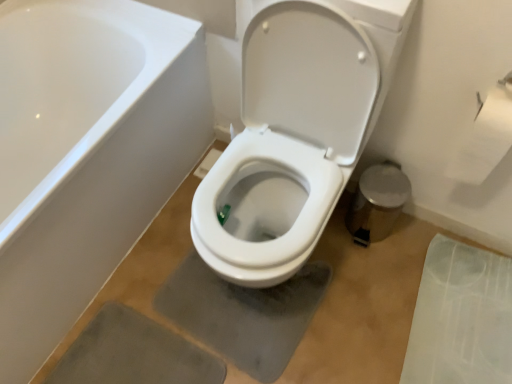
Question: Can you confirm if white glossy toilet at center is positioned to the left of transparent plastic mat at lower right?

Choices:
 (A) yes
 (B) no

Answer: (A)

Question: Considering the relative positions of white glossy toilet at center and transparent plastic mat at lower right in the image provided, is white glossy toilet at center to the right of transparent plastic mat at lower right from the viewer's perspective?

Choices:
 (A) no
 (B) yes

Answer: (A)

Question: Considering the relative sizes of white glossy toilet at center and transparent plastic mat at lower right in the image provided, is white glossy toilet at center wider than transparent plastic mat at lower right?

Choices:
 (A) no
 (B) yes

Answer: (B)

Question: From a real-world perspective, is white glossy toilet at center on top of transparent plastic mat at lower right?

Choices:
 (A) no
 (B) yes

Answer: (B)

Question: Is white glossy toilet at center not near transparent plastic mat at lower right?

Choices:
 (A) no
 (B) yes

Answer: (A)

Question: Considering the relative sizes of white glossy toilet at center and transparent plastic mat at lower right in the image provided, is white glossy toilet at center bigger than transparent plastic mat at lower right?

Choices:
 (A) yes
 (B) no

Answer: (A)

Question: From the image's perspective, is white glossy toilet at center beneath white paper at upper right?

Choices:
 (A) yes
 (B) no

Answer: (A)

Question: Is white glossy toilet at center not near white paper at upper right?

Choices:
 (A) no
 (B) yes

Answer: (A)

Question: Does white glossy toilet at center have a greater width compared to white paper at upper right?

Choices:
 (A) no
 (B) yes

Answer: (B)

Question: Is white glossy toilet at center not inside white paper at upper right?

Choices:
 (A) no
 (B) yes

Answer: (B)

Question: Is white glossy toilet at center to the right of white paper at upper right from the viewer's perspective?

Choices:
 (A) yes
 (B) no

Answer: (B)

Question: Is white glossy toilet at center bigger than white paper at upper right?

Choices:
 (A) no
 (B) yes

Answer: (B)

Question: Does transparent plastic mat at lower right have a greater width compared to white paper at upper right?

Choices:
 (A) no
 (B) yes

Answer: (B)